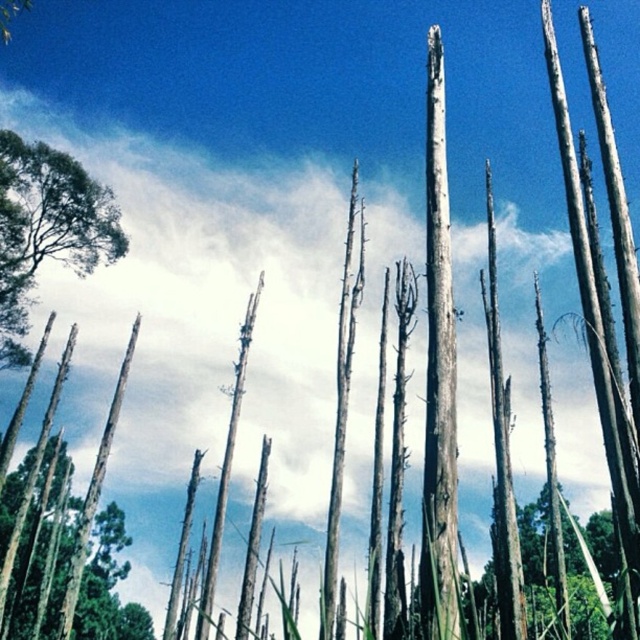
Is point (426, 292) positioned before point (3, 282)?

Yes, it is in front of point (3, 282).

Is gray rough bark tree trunk at center smaller than green leafy tree at left?

No.

The height and width of the screenshot is (640, 640). Identify the location of gray rough bark tree trunk at center. (438, 376).

Locate an element on the screen. The width and height of the screenshot is (640, 640). gray rough bark tree trunk at center is located at coordinates (438, 376).

Between smooth brown tree trunk at lower left and green leafy tree at left, which one is positioned higher?

green leafy tree at left

Where is `smooth brown tree trunk at lower left`? The width and height of the screenshot is (640, 640). smooth brown tree trunk at lower left is located at coordinates (42, 556).

Does gray rough bark tree trunk at center appear under smooth brown tree trunk at lower left?

→ Actually, gray rough bark tree trunk at center is above smooth brown tree trunk at lower left.

Is gray rough bark tree trunk at center positioned in front of smooth brown tree trunk at lower left?

Yes.

Locate an element on the screen. gray rough bark tree trunk at center is located at coordinates (438, 376).